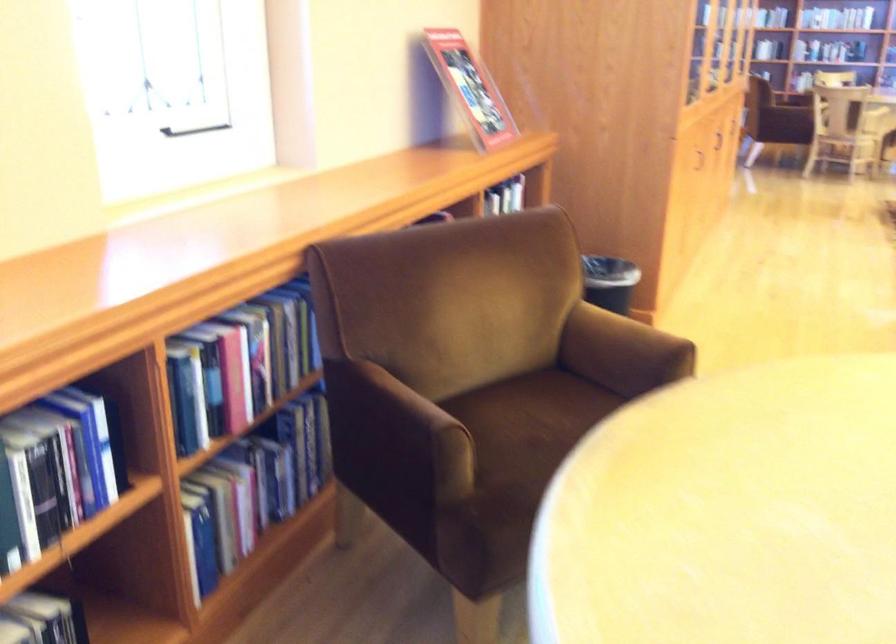
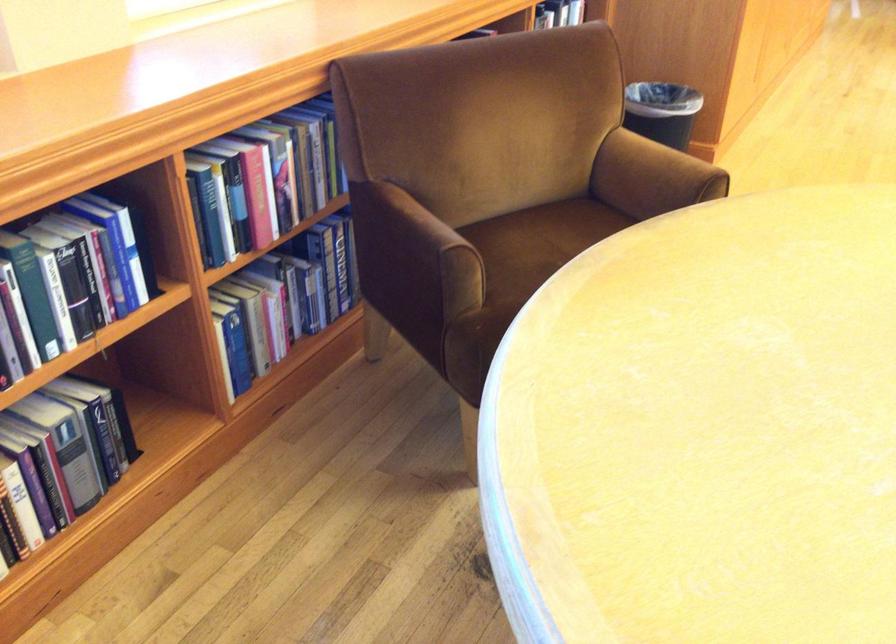
In the second image, find the point that corresponds to the point at 625,345 in the first image.

(655, 171)